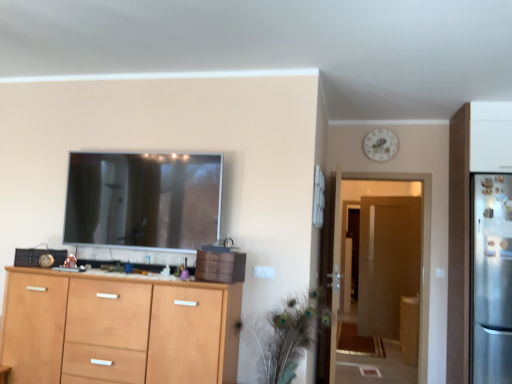
Question: Does satin silver refrigerator at right turn towards transparent glass door at center?

Choices:
 (A) yes
 (B) no

Answer: (B)

Question: Considering the relative sizes of satin silver refrigerator at right and transparent glass door at center in the image provided, is satin silver refrigerator at right taller than transparent glass door at center?

Choices:
 (A) no
 (B) yes

Answer: (A)

Question: Is satin silver refrigerator at right further to the viewer compared to transparent glass door at center?

Choices:
 (A) yes
 (B) no

Answer: (B)

Question: Considering the relative sizes of satin silver refrigerator at right and transparent glass door at center in the image provided, is satin silver refrigerator at right bigger than transparent glass door at center?

Choices:
 (A) no
 (B) yes

Answer: (B)

Question: Can we say satin silver refrigerator at right lies outside transparent glass door at center?

Choices:
 (A) no
 (B) yes

Answer: (B)

Question: Considering their positions, is green feathered plant at center located in front of or behind brown matte drawer at center?

Choices:
 (A) front
 (B) behind

Answer: (A)

Question: In terms of size, does green feathered plant at center appear bigger or smaller than brown matte drawer at center?

Choices:
 (A) big
 (B) small

Answer: (A)

Question: From their relative heights in the image, would you say green feathered plant at center is taller or shorter than brown matte drawer at center?

Choices:
 (A) tall
 (B) short

Answer: (A)

Question: Based on their positions, is green feathered plant at center located to the left or right of brown matte drawer at center?

Choices:
 (A) right
 (B) left

Answer: (A)

Question: From the image's perspective, is white glossy clock at upper center above or below wooden cabinet at right, arranged as the second cabinetry when viewed from the left?

Choices:
 (A) above
 (B) below

Answer: (A)

Question: Looking at their shapes, would you say white glossy clock at upper center is wider or thinner than wooden cabinet at right, the 1th cabinetry in the bottom-to-top sequence?

Choices:
 (A) wide
 (B) thin

Answer: (B)

Question: Looking at the image, does white glossy clock at upper center seem bigger or smaller compared to wooden cabinet at right, the first cabinetry viewed from the back?

Choices:
 (A) small
 (B) big

Answer: (A)

Question: In terms of height, does white glossy clock at upper center look taller or shorter compared to wooden cabinet at right, the first cabinetry viewed from the back?

Choices:
 (A) short
 (B) tall

Answer: (A)

Question: Based on their sizes in the image, would you say light wood cabinet at lower left, marked as the first cabinetry in a top-to-bottom arrangement, is bigger or smaller than white glossy clock at upper center?

Choices:
 (A) big
 (B) small

Answer: (A)

Question: Choose the correct answer: Is light wood cabinet at lower left, the 1th cabinetry from the front, inside white glossy clock at upper center or outside it?

Choices:
 (A) inside
 (B) outside

Answer: (B)